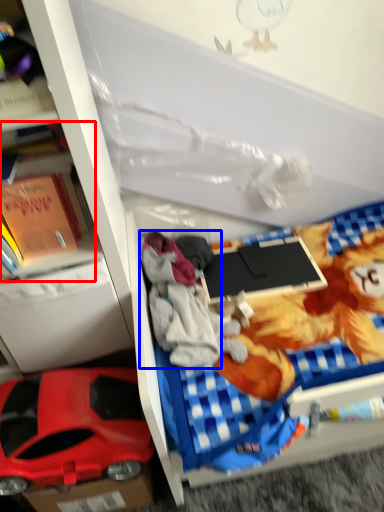
Question: Which object is closer to the camera taking this photo, book (highlighted by a red box) or clothing (highlighted by a blue box)?

Choices:
 (A) book
 (B) clothing

Answer: (A)